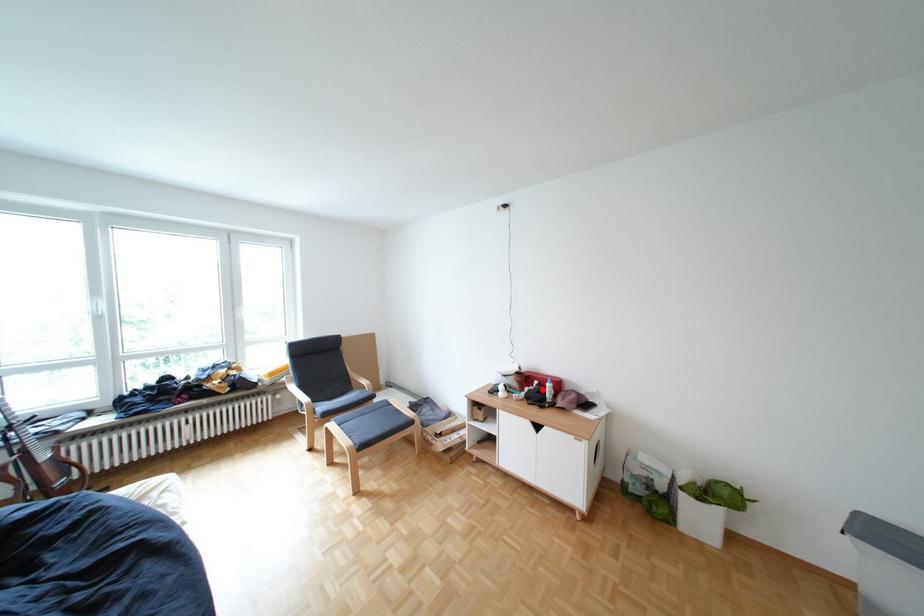
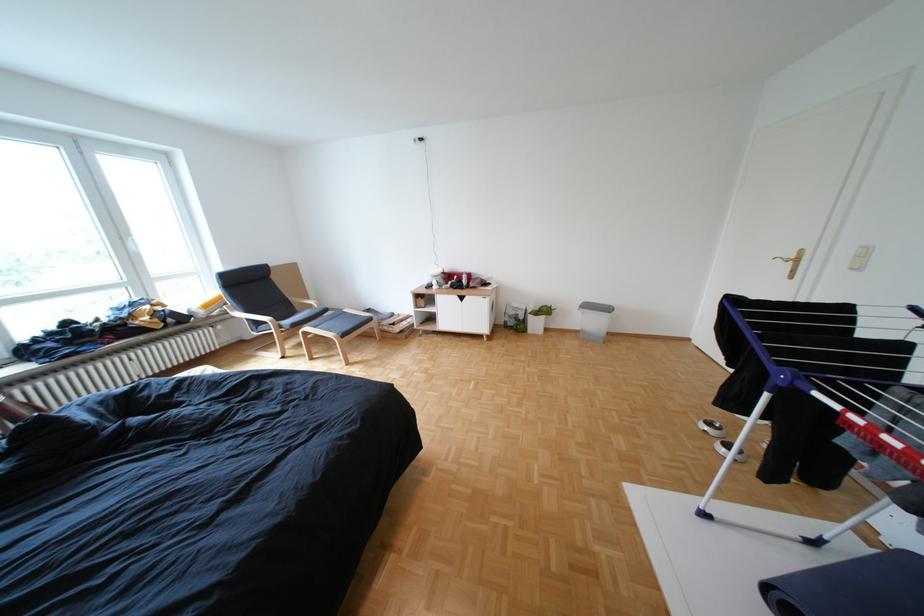
Question: I am providing you with two images of the same scene from different viewpoints. In image1, a red point is highlighted. Considering the same 3D point in image2, which of the following is correct?

Choices:
 (A) It is closer
 (B) It is farther

Answer: (A)